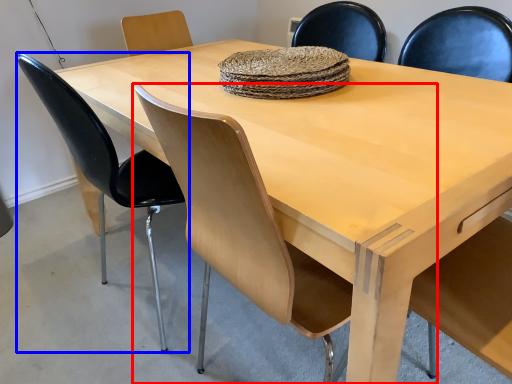
Question: Which object is further to the camera taking this photo, chair (highlighted by a red box) or chair (highlighted by a blue box)?

Choices:
 (A) chair
 (B) chair

Answer: (B)